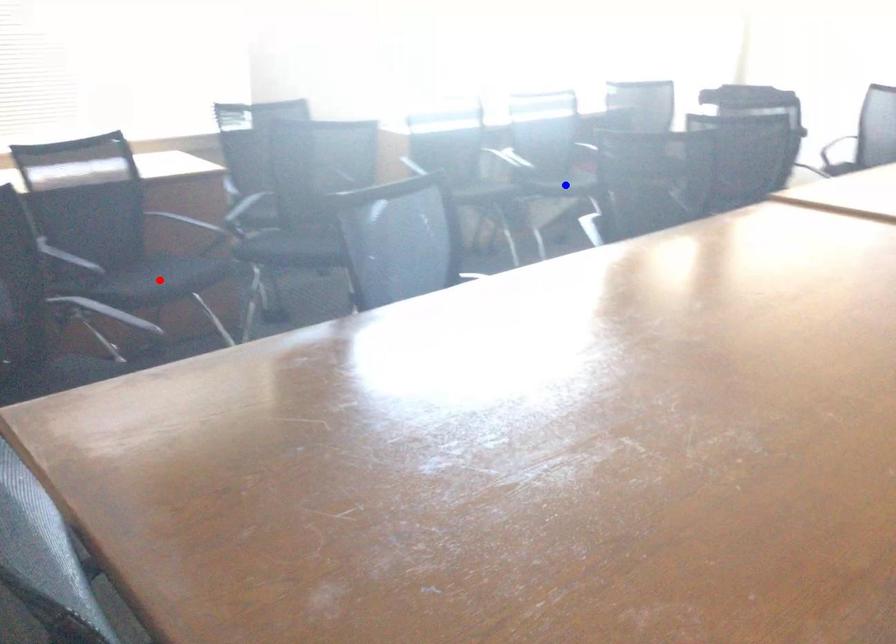
Question: Which of the two points in the image is closer to the camera?

Choices:
 (A) Blue point is closer.
 (B) Red point is closer.

Answer: (B)